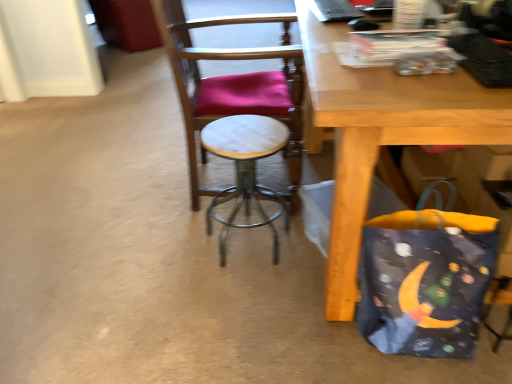
At what (x,y) coordinates should I click in order to perform the action: click on vacant space to the left of dark blue fabric bag at lower right. Please return your answer as a coordinate pair (x, y). The height and width of the screenshot is (384, 512). Looking at the image, I should click on (291, 326).